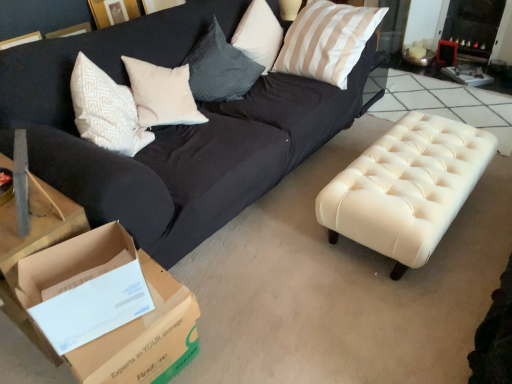
Question: From a real-world perspective, is silky beige pillow at upper right over brown cardboard box at lower left?

Choices:
 (A) yes
 (B) no

Answer: (A)

Question: Can you confirm if silky beige pillow at upper right is shorter than brown cardboard box at lower left?

Choices:
 (A) yes
 (B) no

Answer: (B)

Question: Can you confirm if silky beige pillow at upper right is thinner than brown cardboard box at lower left?

Choices:
 (A) yes
 (B) no

Answer: (B)

Question: From the image's perspective, would you say silky beige pillow at upper right is positioned over brown cardboard box at lower left?

Choices:
 (A) yes
 (B) no

Answer: (A)

Question: From a real-world perspective, is silky beige pillow at upper right positioned under brown cardboard box at lower left based on gravity?

Choices:
 (A) yes
 (B) no

Answer: (B)

Question: Is silky beige pillow at upper right wider or thinner than creamy leather ottoman at center?

Choices:
 (A) thin
 (B) wide

Answer: (A)

Question: Based on their sizes in the image, would you say silky beige pillow at upper right is bigger or smaller than creamy leather ottoman at center?

Choices:
 (A) small
 (B) big

Answer: (B)

Question: From the image's perspective, is silky beige pillow at upper right located above or below creamy leather ottoman at center?

Choices:
 (A) above
 (B) below

Answer: (A)

Question: Is silky beige pillow at upper right inside the boundaries of creamy leather ottoman at center, or outside?

Choices:
 (A) outside
 (B) inside

Answer: (A)

Question: Relative to brown cardboard box at lower left, is creamy leather ottoman at center in front or behind?

Choices:
 (A) behind
 (B) front

Answer: (A)

Question: Considering the positions of creamy leather ottoman at center and brown cardboard box at lower left in the image, is creamy leather ottoman at center bigger or smaller than brown cardboard box at lower left?

Choices:
 (A) big
 (B) small

Answer: (A)

Question: Is point (457, 122) positioned closer to the camera than point (165, 301)?

Choices:
 (A) closer
 (B) farther

Answer: (B)

Question: Is creamy leather ottoman at center inside or outside of brown cardboard box at lower left?

Choices:
 (A) outside
 (B) inside

Answer: (A)

Question: From a real-world perspective, is brown cardboard box at lower left positioned above or below silky beige pillow at upper right?

Choices:
 (A) below
 (B) above

Answer: (A)

Question: Visually, is brown cardboard box at lower left positioned to the left or to the right of silky beige pillow at upper right?

Choices:
 (A) left
 (B) right

Answer: (A)